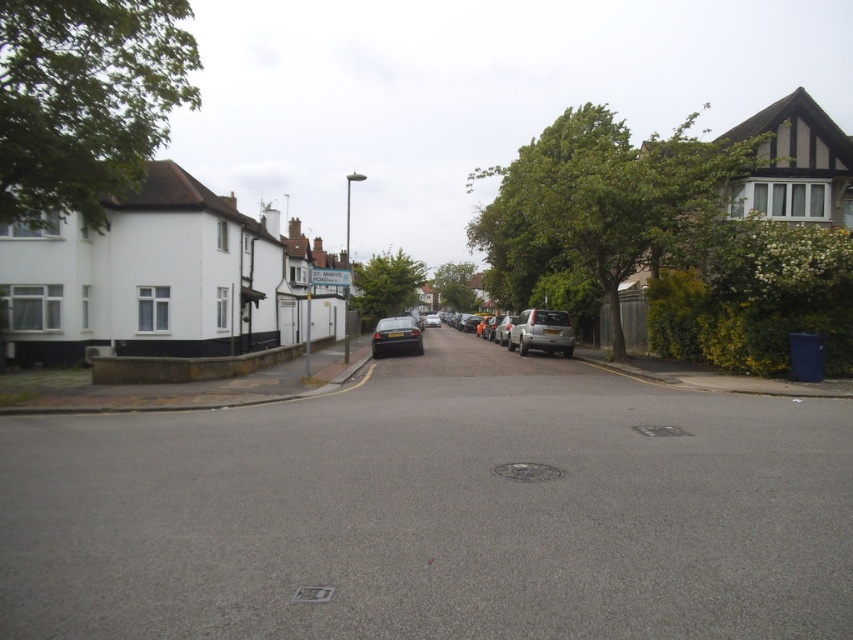
Who is positioned more to the right, satin silver car at center or satin black car at center?

From the viewer's perspective, satin silver car at center appears more on the right side.

Is satin silver car at center shorter than satin black car at center?

No, satin silver car at center is not shorter than satin black car at center.

Is point (550, 308) closer to viewer compared to point (395, 348)?

That is False.

This screenshot has width=853, height=640. In order to click on satin silver car at center in this screenshot , I will do `click(541, 332)`.